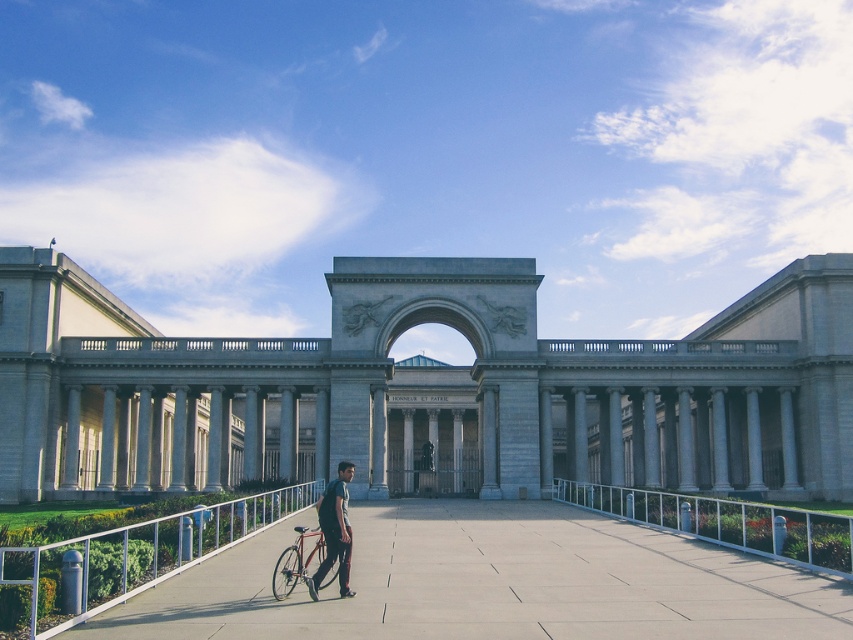
In the scene shown: You are standing at the entrance of the gray stone palace at center and want to place the dark gray fabric backpack at center on a shelf inside the palace. The shelf can only hold items smaller than the palace itself. Will the backpack fit on the shelf?

The gray stone palace at center is larger in size than the dark gray fabric backpack at center, so the backpack is smaller and will fit on the shelf.

You are standing at the entrance of the gray stone palace at center and want to see the white metal railing at lower left. Based on their heights, which one would block your view if you look downward?

The gray stone palace at center has a greater height compared to the white metal railing at lower left, so when looking downward from the entrance, the gray stone palace at center would block your view of the white metal railing at lower left.

You are standing at the entrance of the building and see two points marked on the walkway. The first point is at coordinate point(577,380) and the second is at point(321,506). Which point is closer to you as you face the building?

Point(321,506) is closer to you because it is in front of point(577,380).